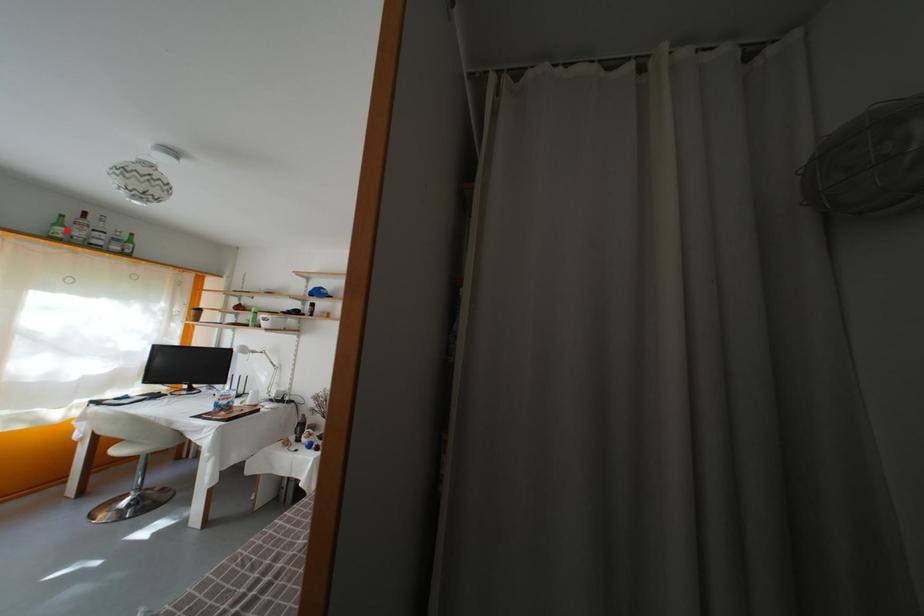
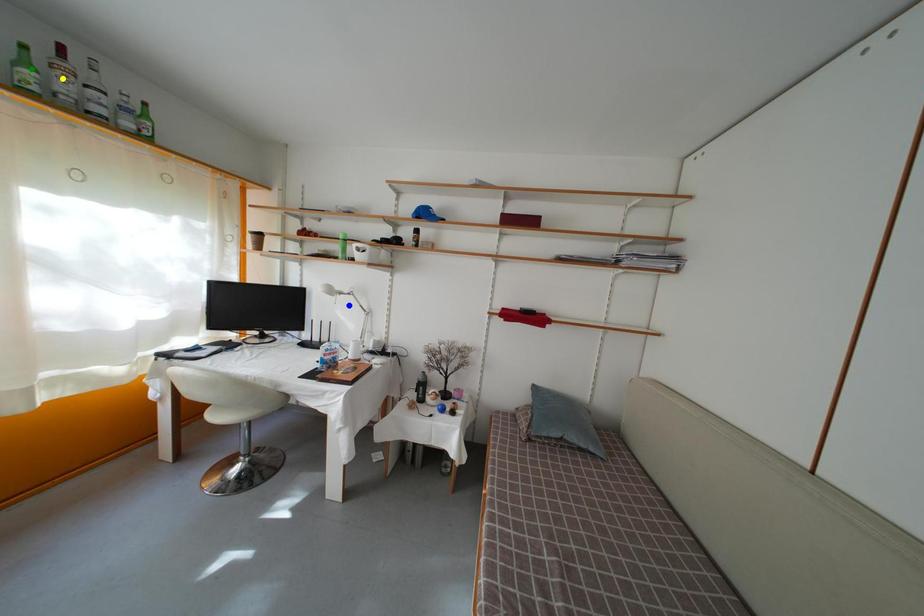
Question: I am providing you with two images of the same scene from different viewpoints. A red point is marked on the first image. You are given multiple points on the second image. Which point in image 2 represents the same 3d spot as the red point in image 1?

Choices:
 (A) yellow point
 (B) green point
 (C) blue point

Answer: (B)